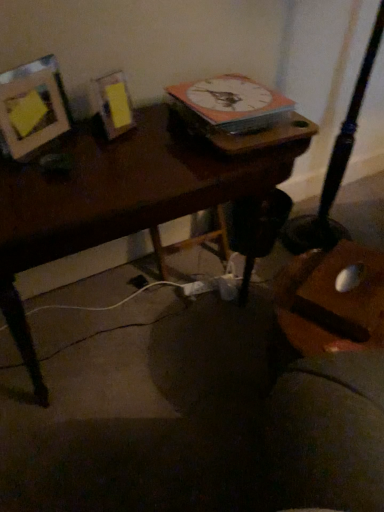
Find the location of `empty space that is ontop of white glossy clock at upper center (from a real-world perspective)`. empty space that is ontop of white glossy clock at upper center (from a real-world perspective) is located at coordinates (229, 84).